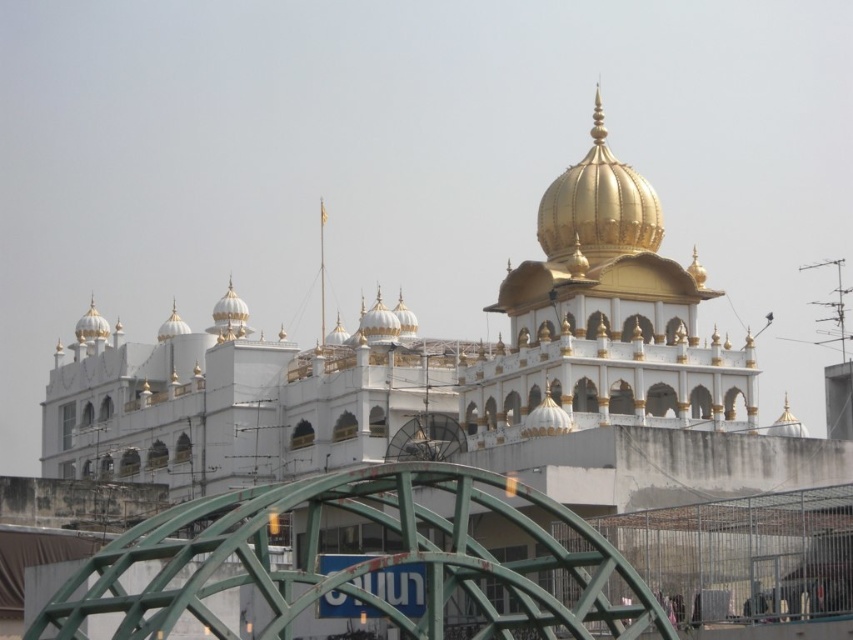
Question: Which of the following is the farthest from the observer?

Choices:
 (A) (640, 179)
 (B) (61, 612)

Answer: (A)

Question: Which point is farther to the camera?

Choices:
 (A) (51, 620)
 (B) (628, 192)

Answer: (B)

Question: Which of the following is the farthest from the observer?

Choices:
 (A) green metallic bridge at lower center
 (B) gold polished dome at center

Answer: (B)

Question: Observing the image, what is the correct spatial positioning of green metallic bridge at lower center in reference to gold polished dome at center?

Choices:
 (A) below
 (B) above

Answer: (A)

Question: Can you confirm if green metallic bridge at lower center is positioned below gold polished dome at center?

Choices:
 (A) no
 (B) yes

Answer: (B)

Question: Is green metallic bridge at lower center below gold polished dome at center?

Choices:
 (A) yes
 (B) no

Answer: (A)